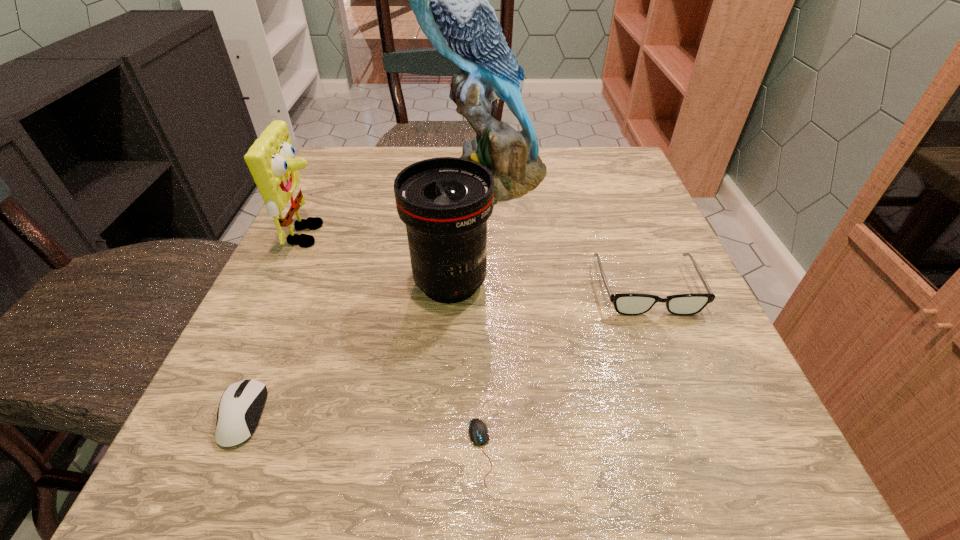
This screenshot has height=540, width=960. I want to click on free space that satisfies the following two spatial constraints: 1. on the face of the sponge; 2. on the left side of the telephoto lens, so click(287, 284).